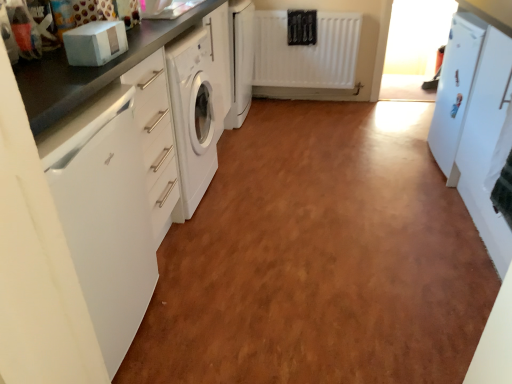
Question: Based on their positions, is white glossy dishwasher at left located to the left or right of white matte refrigerator at right, arranged as the 1th cabinetry when viewed from the front?

Choices:
 (A) left
 (B) right

Answer: (A)

Question: In terms of height, does white glossy dishwasher at left look taller or shorter compared to white matte refrigerator at right, arranged as the 1th cabinetry when viewed from the front?

Choices:
 (A) short
 (B) tall

Answer: (A)

Question: Based on their relative distances, which object is nearer to the white glossy dishwasher at left?

Choices:
 (A) white glossy washing machine at center, positioned as the 1th cabinetry in top-to-bottom order
 (B) white matte refrigerator at right, acting as the second cabinetry starting from the left
 (C) white matte radiator at center
 (D) white glossy refrigerator at right
 (E) matte black countertop at left

Answer: (E)

Question: Which is farther from the white glossy washing machine at center, acting as the 1th cabinetry starting from the left?

Choices:
 (A) white glossy countertop at left
 (B) white glossy refrigerator at right
 (C) white matte refrigerator at right, arranged as the 1th cabinetry when ordered from the bottom
 (D) matte black countertop at left
 (E) white matte radiator at center

Answer: (C)